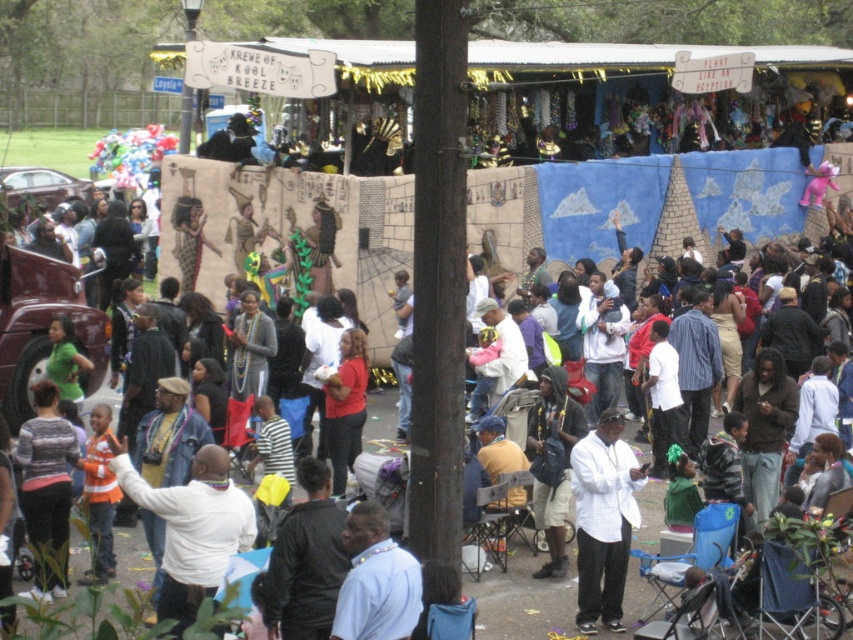
Question: Which point is farther from the camera taking this photo?

Choices:
 (A) (581, 568)
 (B) (363, 576)

Answer: (A)

Question: Which point is farther from the camera taking this photo?

Choices:
 (A) (384, 524)
 (B) (579, 460)

Answer: (B)

Question: Does white matte shirt at center appear over white shirt at center?

Choices:
 (A) yes
 (B) no

Answer: (A)

Question: Does white matte shirt at center have a greater width compared to white shirt at center?

Choices:
 (A) yes
 (B) no

Answer: (A)

Question: Which point is farther to the camera?

Choices:
 (A) white shirt at center
 (B) white matte shirt at center

Answer: (B)

Question: Can you confirm if white matte shirt at center is thinner than white shirt at center?

Choices:
 (A) yes
 (B) no

Answer: (B)